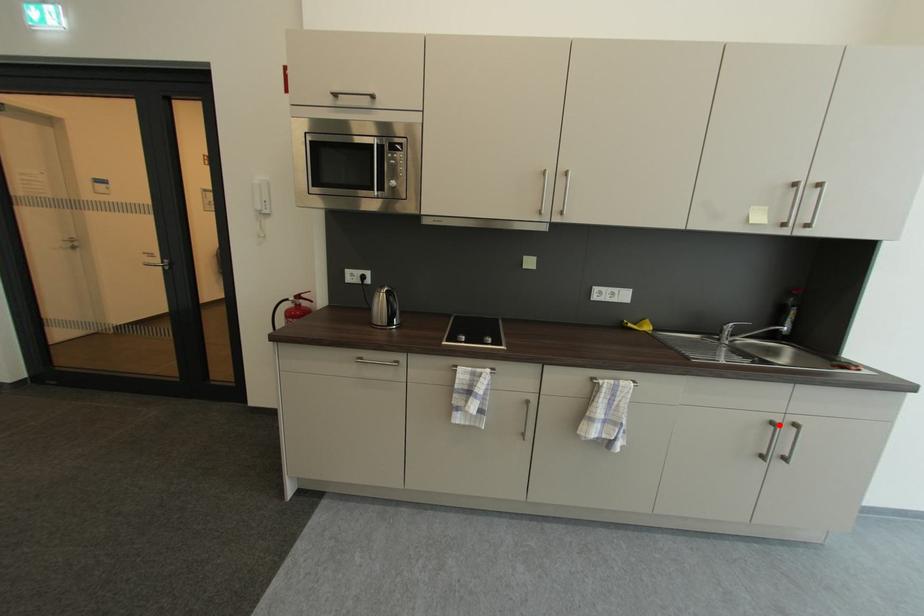
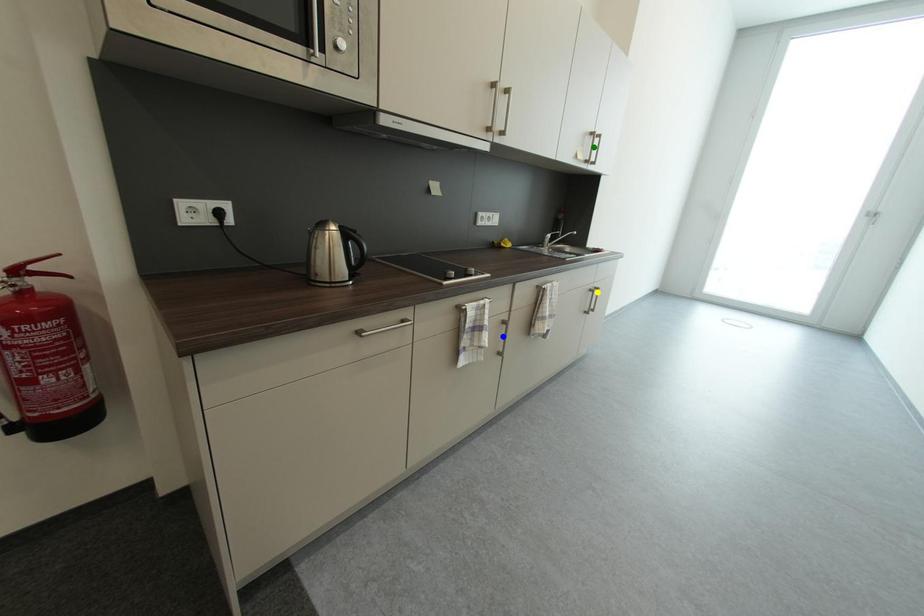
Question: I am providing you with two images of the same scene from different viewpoints. A red point is marked on the first image. You are given multiple points on the second image. Which mark in image 2 goes with the point in image 1?

Choices:
 (A) blue point
 (B) green point
 (C) yellow point

Answer: (C)